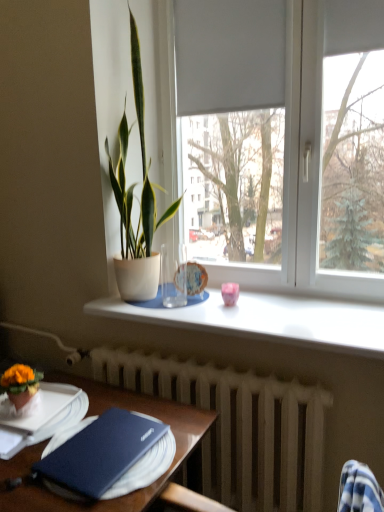
Measure the distance between porcelain plate at center, acting as the second tableware starting from the front, and camera.

1.83 meters.

Where is `porcelain plate at center, acting as the second tableware starting from the front`? porcelain plate at center, acting as the second tableware starting from the front is located at coordinates (195, 278).

The height and width of the screenshot is (512, 384). What do you see at coordinates (127, 409) in the screenshot? I see `wooden table at lower left` at bounding box center [127, 409].

This screenshot has height=512, width=384. What do you see at coordinates (239, 426) in the screenshot? I see `white textured radiator at lower center` at bounding box center [239, 426].

In order to click on porcelain plate at center, acting as the 1th tableware starting from the back in this screenshot , I will do `click(195, 278)`.

In terms of width, does matte blue hardback book at lower left look wider or thinner when compared to wooden table at lower left?

Clearly, matte blue hardback book at lower left has less width compared to wooden table at lower left.

Which is correct: matte blue hardback book at lower left is inside wooden table at lower left, or outside of it?

matte blue hardback book at lower left is inside wooden table at lower left.

Is matte blue hardback book at lower left turned away from wooden table at lower left?

Absolutely, matte blue hardback book at lower left is directed away from wooden table at lower left.

Between matte blue hardback book at lower left and wooden table at lower left, which one has less height?

With less height is matte blue hardback book at lower left.

From the image's perspective, which object appears higher, white matte window at center or matte white pot at center, which is the 1th houseplant in right-to-left order?

white matte window at center appears higher in the image.

Based on their sizes in the image, would you say white matte window at center is bigger or smaller than matte white pot at center, the second houseplant in the bottom-to-top sequence?

white matte window at center is bigger than matte white pot at center, the second houseplant in the bottom-to-top sequence.

Relative to matte white pot at center, the second houseplant from the front, is white matte window at center in front or behind?

white matte window at center is in front of matte white pot at center, the second houseplant from the front.

Does white matte window at center contain white smooth window sill at center?

No, white smooth window sill at center is not inside white matte window at center.

Is white matte window at center closer to the viewer compared to white smooth window sill at center?

No, white matte window at center is further to the viewer.

Can you tell me how much white matte window at center and white smooth window sill at center differ in facing direction?

The facing directions of white matte window at center and white smooth window sill at center are 0.517 degrees apart.

Is white matte window at center beside white smooth window sill at center?

No, white matte window at center is not with white smooth window sill at center.

What's the angular difference between white smooth window sill at center and matte white pot at center, the first houseplant positioned from the back,'s facing directions?

The angular difference between white smooth window sill at center and matte white pot at center, the first houseplant positioned from the back, is 7.21 degrees.

Between white smooth window sill at center and matte white pot at center, the second houseplant in the bottom-to-top sequence, which one appears on the right side from the viewer's perspective?

white smooth window sill at center is more to the right.

Relative to matte white pot at center, the first houseplant positioned from the back, is white smooth window sill at center in front or behind?

white smooth window sill at center is in front of matte white pot at center, the first houseplant positioned from the back.

In the scene shown: From the image's perspective, does orange felt flower pot at lower left, arranged as the 1th houseplant when ordered from the bottom, appear lower than wooden table at lower left?

No, from the image's perspective, orange felt flower pot at lower left, arranged as the 1th houseplant when ordered from the bottom, is not beneath wooden table at lower left.

Considering their positions, is orange felt flower pot at lower left, the 2th houseplant positioned from the top, located in front of or behind wooden table at lower left?

Visually, orange felt flower pot at lower left, the 2th houseplant positioned from the top, is located behind wooden table at lower left.

Is orange felt flower pot at lower left, placed as the second houseplant when sorted from right to left, positioned beyond the bounds of wooden table at lower left?

Absolutely, orange felt flower pot at lower left, placed as the second houseplant when sorted from right to left, is external to wooden table at lower left.

From a real-world perspective, is pink glossy cup at center, the 2th tableware from the back, located beneath wooden table at lower left?

No, from a real-world perspective, pink glossy cup at center, the 2th tableware from the back, is not under wooden table at lower left.

Is pink glossy cup at center, the second tableware from the left, beside wooden table at lower left?

pink glossy cup at center, the second tableware from the left, is not next to wooden table at lower left, and they're not touching.

Between pink glossy cup at center, the second tableware from the left, and wooden table at lower left, which one appears on the right side from the viewer's perspective?

Positioned to the right is pink glossy cup at center, the second tableware from the left.

Which object is further away from the camera, pink glossy cup at center, which ranks as the first tableware in right-to-left order, or wooden table at lower left?

pink glossy cup at center, which ranks as the first tableware in right-to-left order, is behind.

Is pink glossy cup at center, the 1th tableware from the front, at the back of white textured radiator at lower center?

white textured radiator at lower center is not turned away from pink glossy cup at center, the 1th tableware from the front.

From the image's perspective, is white textured radiator at lower center on pink glossy cup at center, the 2th tableware from the back?

No.

From the image's perspective, which tableware is the 1st one above the white textured radiator at lower center? Please provide its 2D coordinates.

[(230, 293)]

Between white textured radiator at lower center and pink glossy cup at center, the 2th tableware from the back, which one appears on the left side from the viewer's perspective?

Positioned to the left is white textured radiator at lower center.

This screenshot has width=384, height=512. Find the location of `table below the matte blue hardback book at lower left (from the image's perspective)`. table below the matte blue hardback book at lower left (from the image's perspective) is located at coordinates (127, 409).

I want to click on houseplant that is the 1st one when counting leftward from the white matte window at center, so click(136, 198).

Considering their positions, is wooden table at lower left positioned closer to white smooth window sill at center than orange felt flower pot at lower left, arranged as the 1th houseplant when ordered from the bottom?

wooden table at lower left is positioned closer to the anchor white smooth window sill at center.

When comparing their distances from orange felt flower pot at lower left, arranged as the 1th houseplant when ordered from the bottom, does matte blue hardback book at lower left or white smooth window sill at center seem further?

The object further to orange felt flower pot at lower left, arranged as the 1th houseplant when ordered from the bottom, is white smooth window sill at center.

Considering their positions, is white matte window at center positioned closer to porcelain plate at center, acting as the 1th tableware starting from the back, than white smooth window sill at center?

Among the two, white smooth window sill at center is located nearer to porcelain plate at center, acting as the 1th tableware starting from the back.

Which object lies nearer to the anchor point white textured radiator at lower center, white matte window at center or white smooth window sill at center?

white smooth window sill at center is closer to white textured radiator at lower center.

From the image, which object appears to be farther from white smooth window sill at center, pink glossy cup at center, the 1th tableware from the front, or orange felt flower pot at lower left, arranged as the first houseplant when viewed from the front?

orange felt flower pot at lower left, arranged as the first houseplant when viewed from the front, lies further to white smooth window sill at center than the other object.

Considering their positions, is orange felt flower pot at lower left, placed as the second houseplant when sorted from right to left, positioned further to white textured radiator at lower center than wooden table at lower left?

orange felt flower pot at lower left, placed as the second houseplant when sorted from right to left, lies further to white textured radiator at lower center than the other object.

Which object lies further to the anchor point porcelain plate at center, acting as the 1th tableware starting from the back, white textured radiator at lower center or pink glossy cup at center, the 1th tableware from the front?

Based on the image, white textured radiator at lower center appears to be further to porcelain plate at center, acting as the 1th tableware starting from the back.

From the image, which object appears to be nearer to white textured radiator at lower center, porcelain plate at center, arranged as the second tableware when viewed from the right, or orange felt flower pot at lower left, placed as the second houseplant when sorted from right to left?

porcelain plate at center, arranged as the second tableware when viewed from the right, is closer to white textured radiator at lower center.

Identify the location of hardback book between orange felt flower pot at lower left, arranged as the 1th houseplant when ordered from the bottom, and white textured radiator at lower center from left to right. The height and width of the screenshot is (512, 384). (145, 467).

At what (x,y) coordinates should I click in order to perform the action: click on tableware situated between orange felt flower pot at lower left, arranged as the 1th houseplant when ordered from the bottom, and white textured radiator at lower center from left to right. Please return your answer as a coordinate pair (x, y). Looking at the image, I should click on (195, 278).

Find the location of a particular element. Image resolution: width=384 pixels, height=512 pixels. table between orange felt flower pot at lower left, the 1th houseplant in the left-to-right sequence, and white smooth window sill at center from left to right is located at coordinates (127, 409).

This screenshot has height=512, width=384. In order to click on houseplant between matte white pot at center, the second houseplant from the front, and wooden table at lower left, in the vertical direction in this screenshot , I will do `click(20, 384)`.